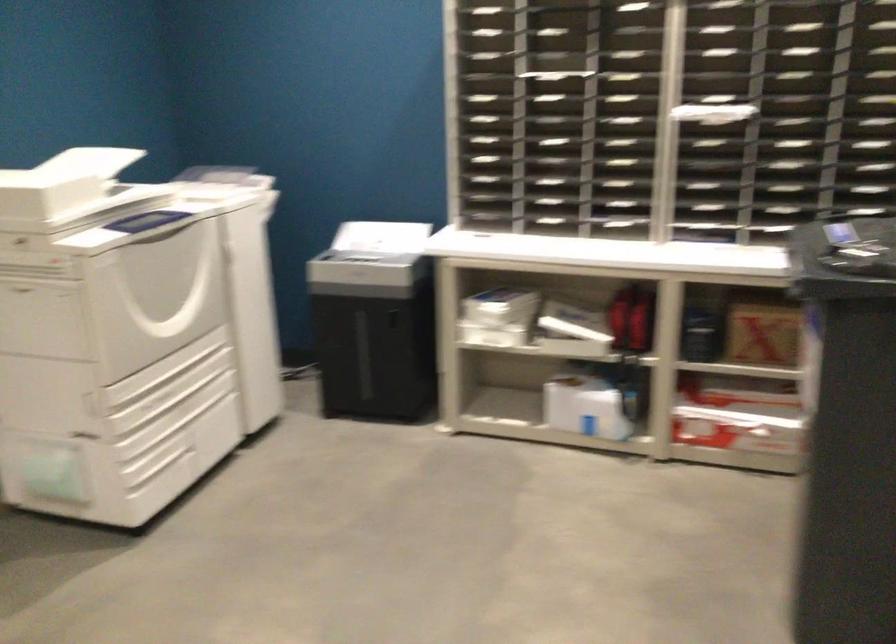
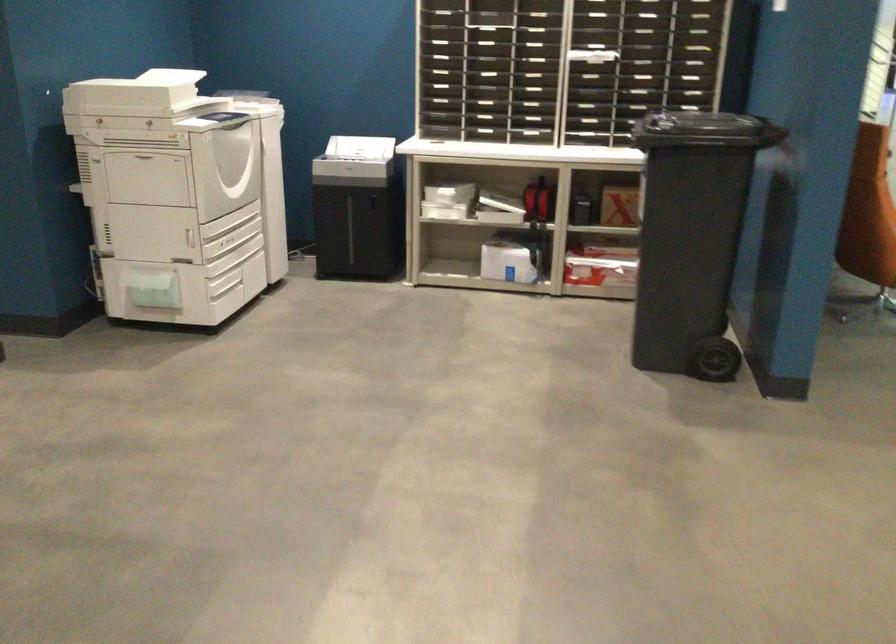
Question: What movement of the cameraman would produce the second image?

Choices:
 (A) Left
 (B) Right
 (C) Forward
 (D) Backward

Answer: (D)